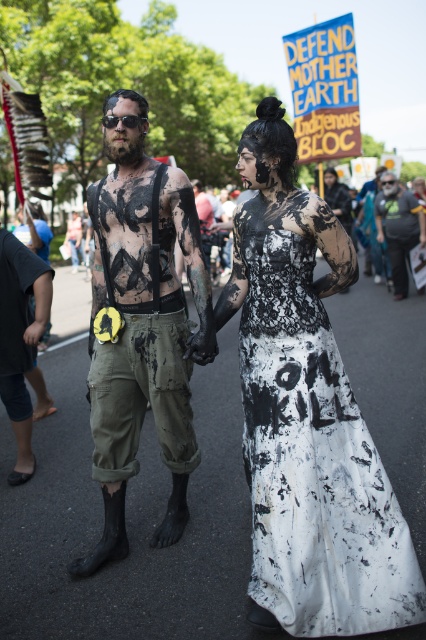
You are a photographer trying to capture the protesters in the image. You notice two clothing items, the white fabric shirt at right and the black matte dress at center. Which one appears to be thinner in width?

The white fabric shirt at right is thinner than the black matte dress at center, so the white fabric shirt at right appears to be thinner in width.

Based on the photo, you are a photographer trying to capture both the white lace dress at center and the white fabric shirt at right in a single frame. Which clothing item should you focus on first to ensure they both fit in the shot?

The white lace dress at center is wider than the white fabric shirt at right, so you should focus on framing the white lace dress at center first to accommodate its larger width.